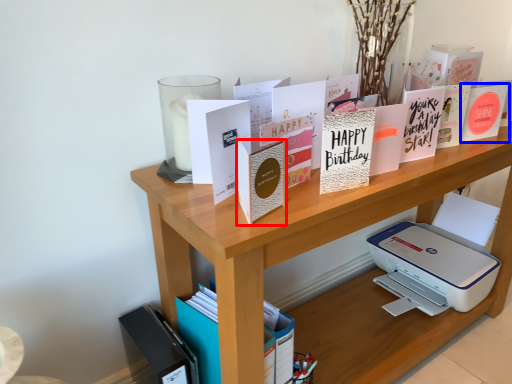
Question: Among these objects, which one is farthest to the camera, paperback book (highlighted by a red box) or paperback book (highlighted by a blue box)?

Choices:
 (A) paperback book
 (B) paperback book

Answer: (B)